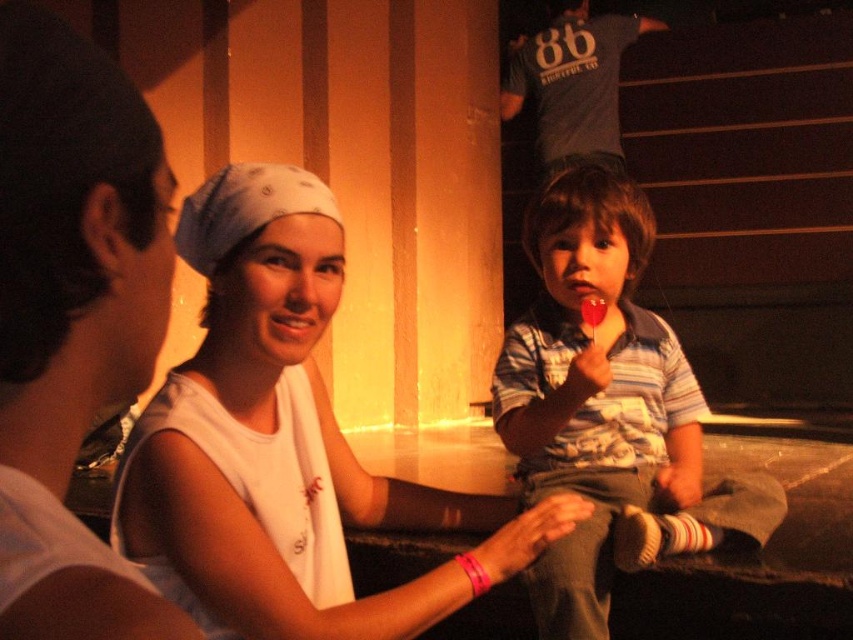
You are a tailor measuring the distance between the white fabric headband at center and the striped cotton shirt at center for a costume design. Can the headband be attached to the shirt without overlapping?

The distance between the white fabric headband at center and the striped cotton shirt at center is 19.73 inches, so the headband can be attached to the shirt without overlapping as there is sufficient space between them.

Looking at this image, based on the scene described, which object is shorter in height between the white fabric headband at center and the striped cotton shirt at center?

The white fabric headband at center is shorter in height than the striped cotton shirt at center.

Based on the scene description, can you determine if the white fabric headband at center is wider than the striped cotton shirt at center?

The white fabric headband at center is wider than the striped cotton shirt at center according to the description.